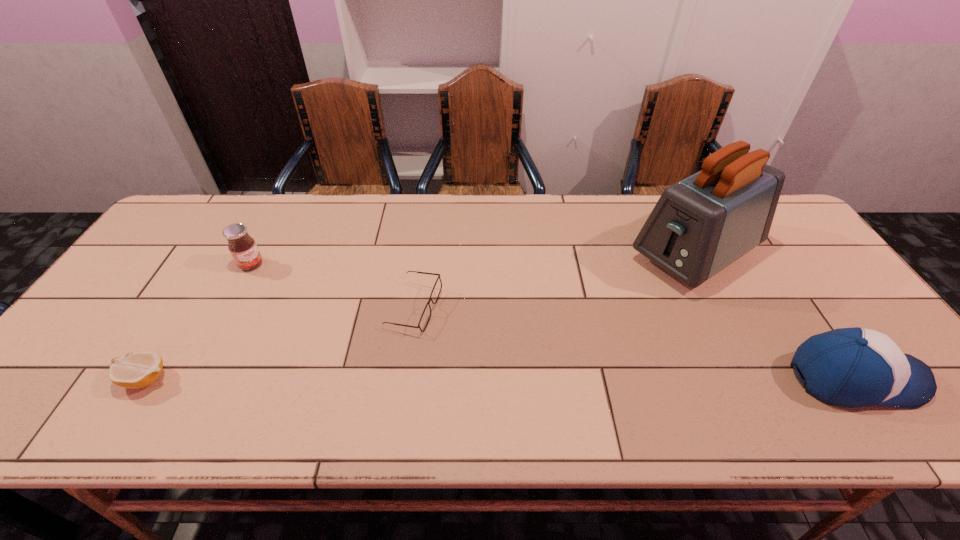
The image size is (960, 540). Find the location of `vacant point located 0.130m on the label side of the jam`. vacant point located 0.130m on the label side of the jam is located at coordinates (284, 291).

Image resolution: width=960 pixels, height=540 pixels. I want to click on blank space located on the label side of the jam, so click(347, 340).

Locate an element on the screen. vacant region located on the front-facing side of the tallest object is located at coordinates (581, 323).

At what (x,y) coordinates should I click in order to perform the action: click on vacant space located on the front-facing side of the tallest object. Please return your answer as a coordinate pair (x, y). The image size is (960, 540). Looking at the image, I should click on [x=575, y=327].

Image resolution: width=960 pixels, height=540 pixels. Find the location of `blank space located on the front-facing side of the tallest object`. blank space located on the front-facing side of the tallest object is located at coordinates (572, 328).

Find the location of a particular element. This screenshot has width=960, height=540. object that is at the far edge is located at coordinates (700, 225).

Where is `lemon that is positioned at the near edge`? lemon that is positioned at the near edge is located at coordinates (138, 369).

Where is `baseball cap at the near edge`? The height and width of the screenshot is (540, 960). baseball cap at the near edge is located at coordinates (854, 367).

Locate an element on the screen. object present at the left edge is located at coordinates (138, 369).

This screenshot has width=960, height=540. In order to click on baseball cap that is at the right edge in this screenshot , I will do `click(854, 367)`.